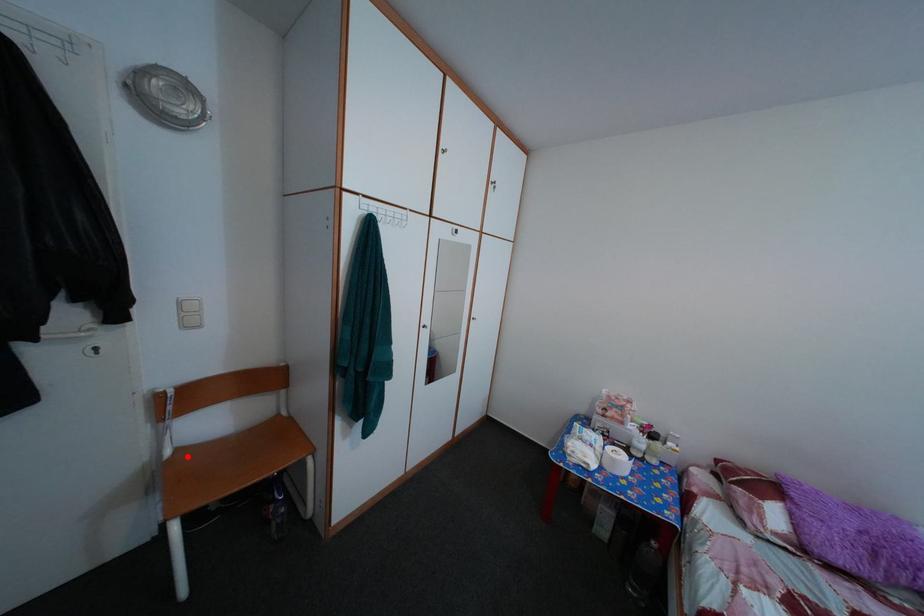
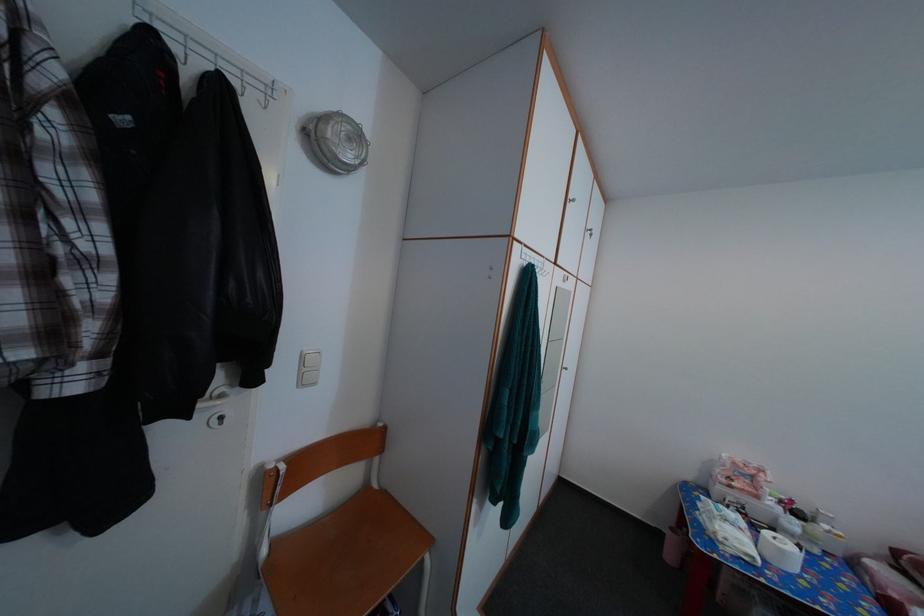
In the second image, find the point that corresponds to the highlighted location in the first image.

(282, 552)